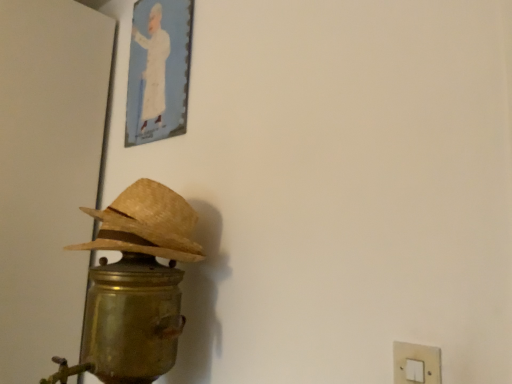
Question: From a real-world perspective, is gold metallic table lamp at left above or below braided straw hat at left?

Choices:
 (A) above
 (B) below

Answer: (B)

Question: From the image's perspective, is gold metallic table lamp at left positioned above or below braided straw hat at left?

Choices:
 (A) above
 (B) below

Answer: (B)

Question: Which is farther from the white plastic light switch at lower right?

Choices:
 (A) gold metallic table lamp at left
 (B) braided straw hat at left

Answer: (B)

Question: Which is nearer to the white plastic light switch at lower right?

Choices:
 (A) braided straw hat at left
 (B) gold metallic table lamp at left

Answer: (B)